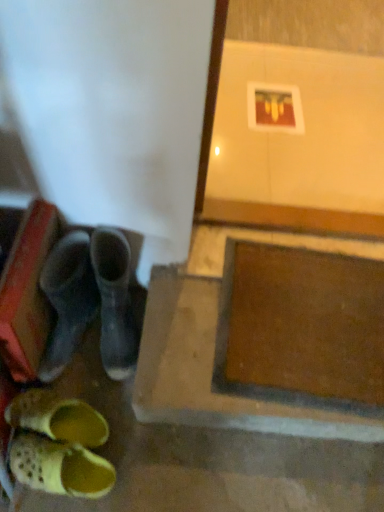
This screenshot has height=512, width=384. I want to click on vacant area that is situated to the right of yellow mesh clog at lower left, so click(148, 467).